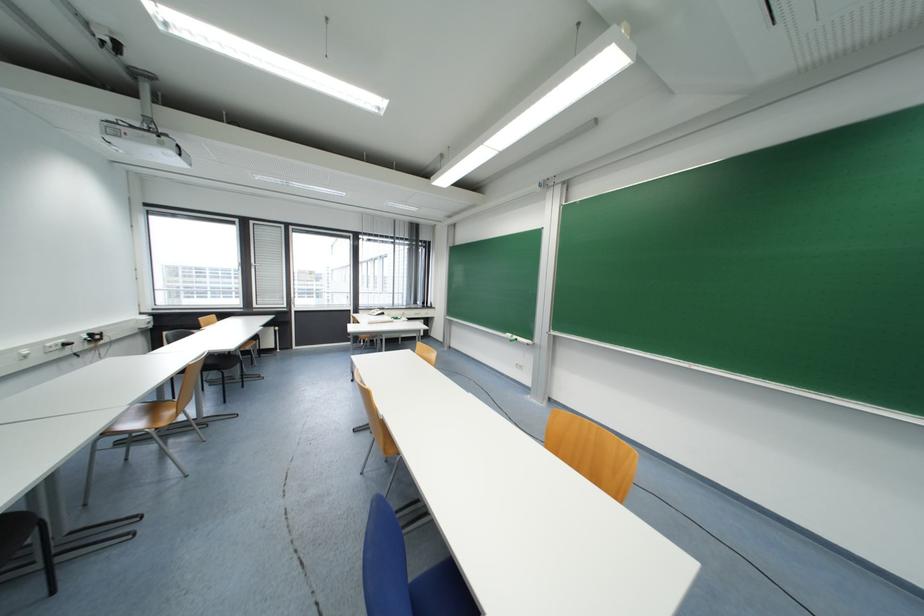
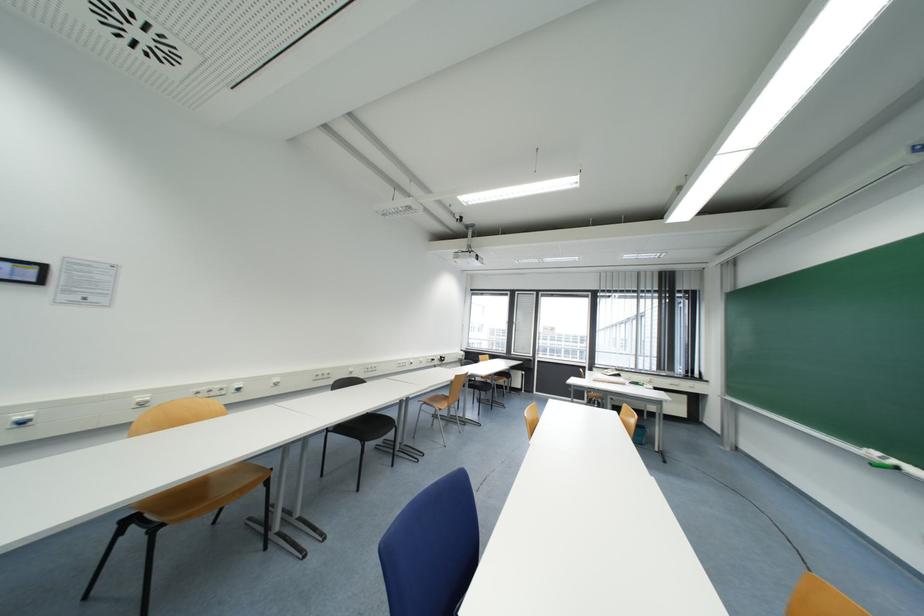
Find the pixel in the second image that matches (541,187) in the first image.

(909, 154)